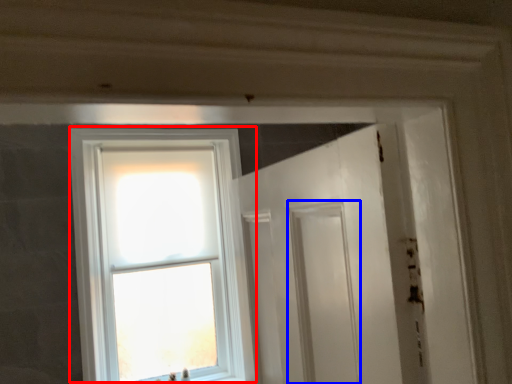
Question: Which object appears farthest to the camera in this image, window (highlighted by a red box) or screen door (highlighted by a blue box)?

Choices:
 (A) window
 (B) screen door

Answer: (B)